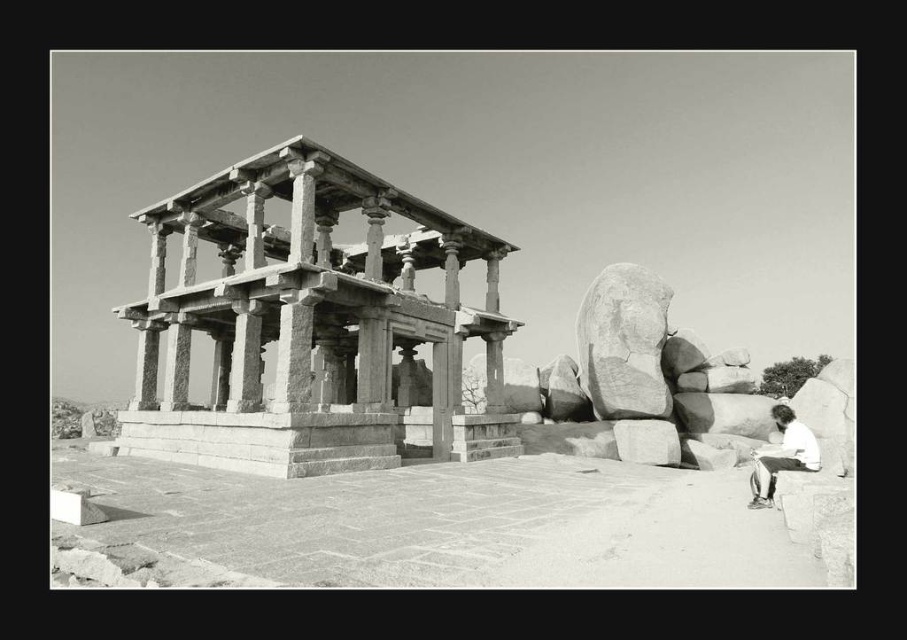
You are an archaeologist examining the ancient stone structure. You notice the smooth gray rock at center and the white cotton shirt at lower right in the scene. Which object occupies more horizontal space in the image?

The white cotton shirt at lower right occupies more horizontal space because it has a greater width than the smooth gray rock at center.

You are a tourist standing at the base of the ancient stone structure. You notice two points marked on the structure. The first point is at coordinates point [188,380] and the second is at point [767,504]. Which point is closer to you?

Point [767,504] is closer to you because it is in front of point [188,380].